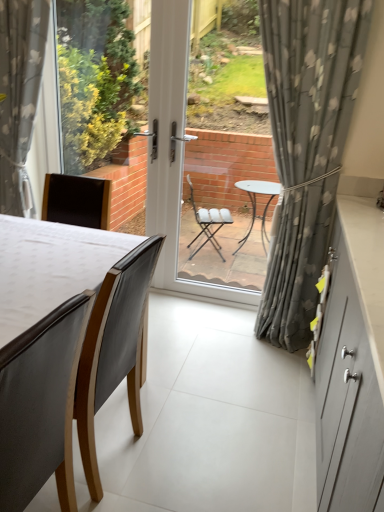
You are a GUI agent. You are given a task and a screenshot of the screen. Output one action in this format:
    pyautogui.click(x=<x>, y=<y>)
    Task: Click on the free point behind matte black chair at left, which ranks as the first chair in back-to-front order
    The height and width of the screenshot is (512, 384).
    Given the screenshot: What is the action you would take?
    pyautogui.click(x=151, y=407)